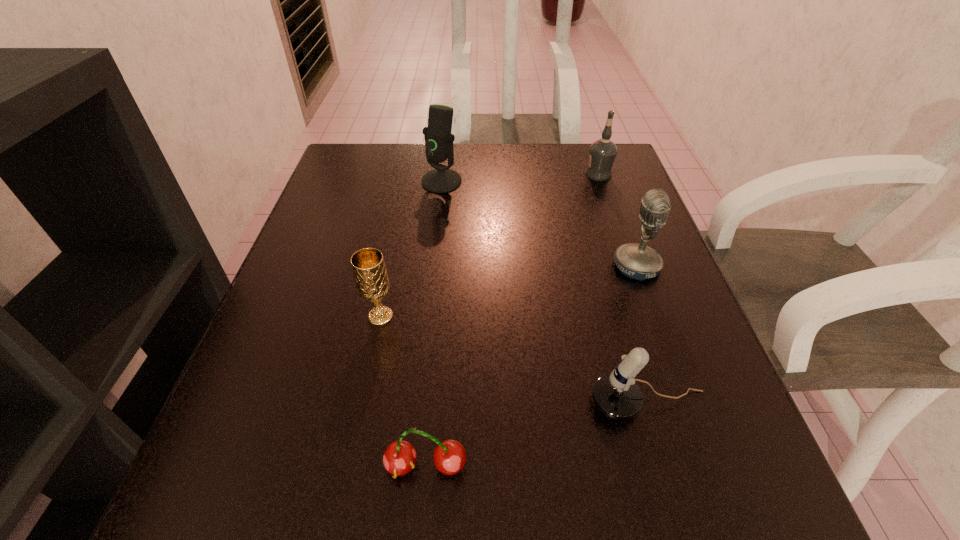
Locate an element on the screen. the fifth closest object to the leftmost microphone is located at coordinates (400, 457).

The image size is (960, 540). Identify the location of object identified as the closest to the fourth nearest object. (616, 395).

Locate an element on the screen. microphone that is the second closest to the farthest microphone is located at coordinates (616, 395).

Find the location of a particular element. This screenshot has height=540, width=960. microphone that stands as the second closest to the leftmost microphone is located at coordinates (616, 395).

Where is `free location that satisfies the following two spatial constraints: 1. on the front-facing side of the third farthest object; 2. with stems pointing upwards on the shortest object`? free location that satisfies the following two spatial constraints: 1. on the front-facing side of the third farthest object; 2. with stems pointing upwards on the shortest object is located at coordinates (709, 466).

Identify the location of free region that satisfies the following two spatial constraints: 1. on the front-facing side of the fourth nearest object; 2. with stems pointing upwards on the cherry. The image size is (960, 540). (709, 466).